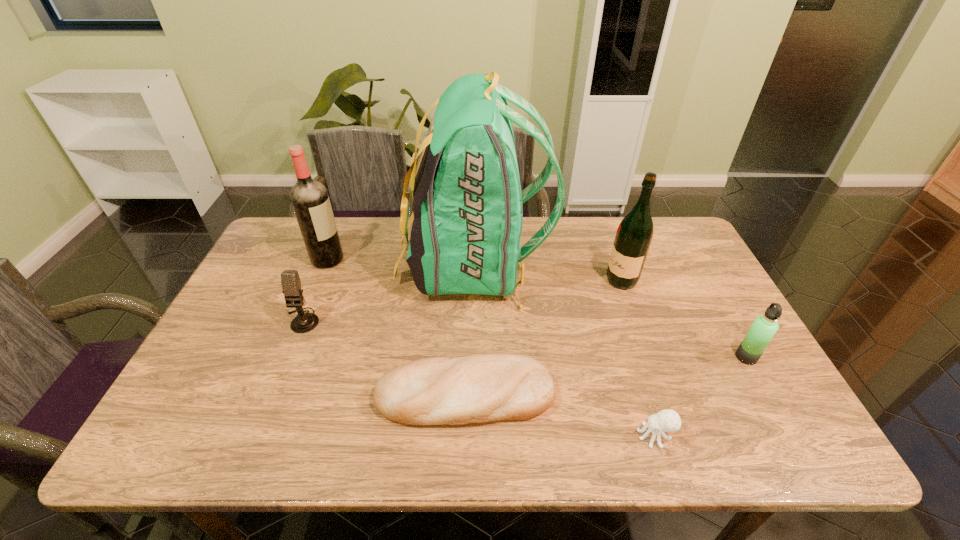
This screenshot has height=540, width=960. Find the location of `vacant space located on the front-facing side of the nearer liquor`. vacant space located on the front-facing side of the nearer liquor is located at coordinates (543, 281).

Locate an element on the screen. The width and height of the screenshot is (960, 540). free space located 0.250m on the front-facing side of the nearer liquor is located at coordinates (523, 281).

Locate an element on the screen. The height and width of the screenshot is (540, 960). vacant space located on the front-facing side of the nearer liquor is located at coordinates (580, 281).

I want to click on vacant space located on the back of the rightmost object, so click(x=699, y=272).

I want to click on vacant space located on the front-facing side of the microphone, so click(261, 422).

The height and width of the screenshot is (540, 960). I want to click on free space located on the left of the bread, so pos(235,396).

You are a GUI agent. You are given a task and a screenshot of the screen. Output one action in this format:
    pyautogui.click(x=<x>, y=<y>)
    Task: Click on the free region located 0.310m on the front-facing side of the octopus
    The image size is (960, 540).
    Given the screenshot: What is the action you would take?
    pyautogui.click(x=495, y=436)

Where is `vacant space located on the front-facing side of the octopus`? vacant space located on the front-facing side of the octopus is located at coordinates (476, 436).

The height and width of the screenshot is (540, 960). I want to click on free space located on the front-facing side of the octopus, so click(596, 436).

What are the coordinates of `backpack present at the far edge` in the screenshot? It's located at (467, 201).